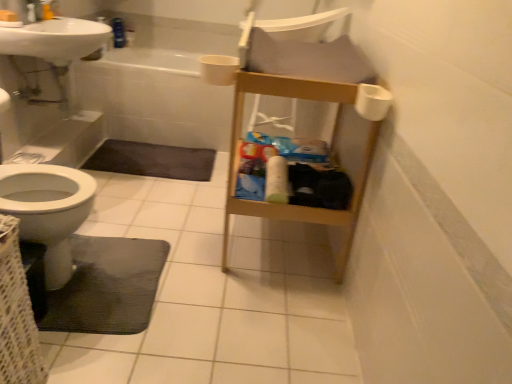
Question: Considering the relative sizes of woven fabric basket at lower left and white matte toilet paper at center, the 2th toilet paper from the front, in the image provided, is woven fabric basket at lower left wider than white matte toilet paper at center, the 2th toilet paper from the front,?

Choices:
 (A) yes
 (B) no

Answer: (A)

Question: Would you say woven fabric basket at lower left contains white matte toilet paper at center, the 2th toilet paper from the front?

Choices:
 (A) yes
 (B) no

Answer: (B)

Question: Is woven fabric basket at lower left behind white matte toilet paper at center, arranged as the first toilet paper when ordered from the bottom?

Choices:
 (A) no
 (B) yes

Answer: (A)

Question: From the image's perspective, does woven fabric basket at lower left appear lower than white matte toilet paper at center, the 2th toilet paper from the right?

Choices:
 (A) no
 (B) yes

Answer: (B)

Question: Does woven fabric basket at lower left have a larger size compared to white matte toilet paper at center, the 2th toilet paper from the right?

Choices:
 (A) yes
 (B) no

Answer: (A)

Question: Is woven fabric basket at lower left thinner than white matte toilet paper at center, arranged as the first toilet paper when ordered from the bottom?

Choices:
 (A) no
 (B) yes

Answer: (A)

Question: Is white glossy sink at upper left smaller than white glossy bathtub at upper center?

Choices:
 (A) no
 (B) yes

Answer: (B)

Question: Is the position of white glossy sink at upper left less distant than that of white glossy bathtub at upper center?

Choices:
 (A) no
 (B) yes

Answer: (B)

Question: From the image's perspective, would you say white glossy sink at upper left is shown under white glossy bathtub at upper center?

Choices:
 (A) no
 (B) yes

Answer: (A)

Question: Can you confirm if white glossy sink at upper left is bigger than white glossy bathtub at upper center?

Choices:
 (A) no
 (B) yes

Answer: (A)

Question: Does white glossy sink at upper left lie behind white glossy bathtub at upper center?

Choices:
 (A) no
 (B) yes

Answer: (A)

Question: Can you confirm if white glossy sink at upper left is taller than white glossy bathtub at upper center?

Choices:
 (A) yes
 (B) no

Answer: (B)

Question: Can you confirm if white matte toilet paper at upper right, the first toilet paper positioned from the front, is positioned to the right of white glossy bathtub at upper center?

Choices:
 (A) yes
 (B) no

Answer: (A)